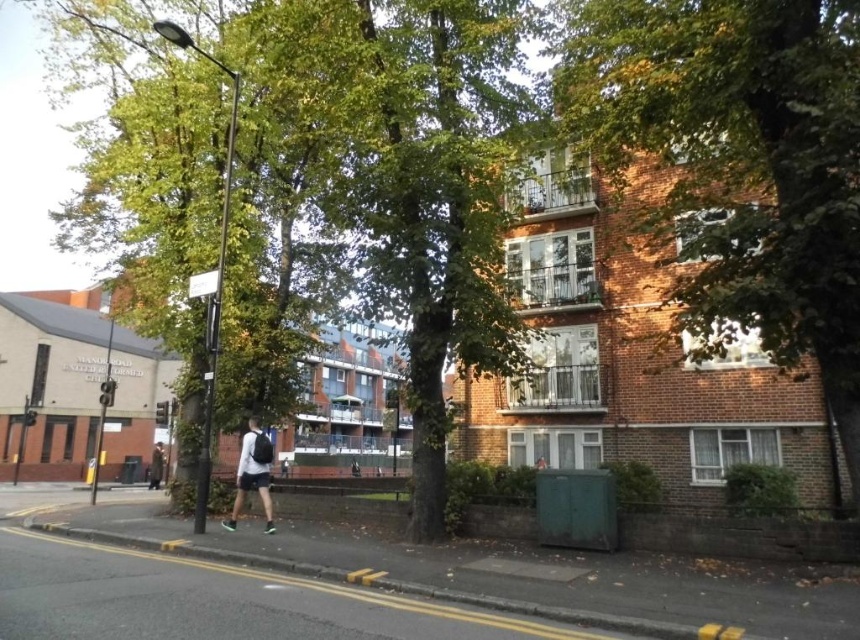
Question: Can you confirm if green leafy tree at upper center is thinner than dark gray backpack at lower left?

Choices:
 (A) no
 (B) yes

Answer: (B)

Question: Which of the following is the closest to the observer?

Choices:
 (A) white matte shirt at center
 (B) green leafy tree at upper center
 (C) dark gray backpack at lower left

Answer: (B)

Question: Among these points, which one is nearest to the camera?

Choices:
 (A) (240, 496)
 (B) (157, 444)
 (C) (733, 12)

Answer: (C)

Question: Which of these objects is positioned closest to the white matte shirt at center?

Choices:
 (A) green leafy tree at upper center
 (B) dark gray backpack at lower left

Answer: (A)

Question: Does green leafy tree at upper center have a lesser width compared to white matte shirt at center?

Choices:
 (A) yes
 (B) no

Answer: (B)

Question: Is white matte shirt at center positioned before dark gray backpack at lower left?

Choices:
 (A) yes
 (B) no

Answer: (A)